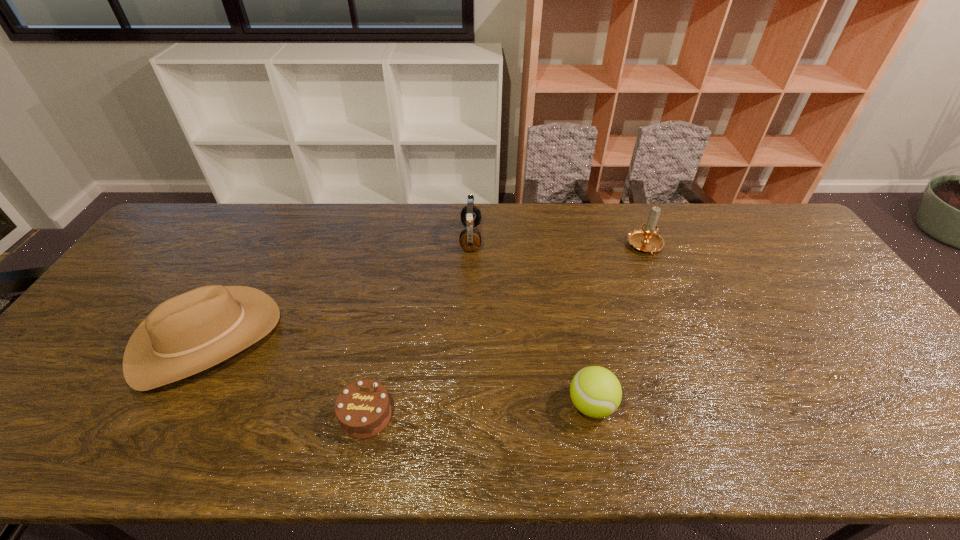
Where is `free space located on the right of the second object from right to left`? The width and height of the screenshot is (960, 540). free space located on the right of the second object from right to left is located at coordinates tap(663, 405).

Where is `vacant space located 0.120m on the back of the chocolate cake`? The width and height of the screenshot is (960, 540). vacant space located 0.120m on the back of the chocolate cake is located at coordinates (379, 352).

You are a GUI agent. You are given a task and a screenshot of the screen. Output one action in this format:
    pyautogui.click(x=<x>, y=<y>)
    Task: Click on the candle present at the far edge
    Image resolution: width=960 pixels, height=540 pixels.
    Given the screenshot: What is the action you would take?
    pyautogui.click(x=646, y=239)

Find the location of a particular element. headset that is at the far edge is located at coordinates (470, 239).

Locate an element on the screen. The image size is (960, 540). tennis ball at the near edge is located at coordinates (595, 391).

The width and height of the screenshot is (960, 540). Find the location of `chocolate cake that is at the near edge`. chocolate cake that is at the near edge is located at coordinates (363, 410).

This screenshot has height=540, width=960. Identify the location of object that is positioned at the left edge. (191, 332).

Identify the location of free space at the far edge of the desktop. (336, 233).

Locate an element on the screen. This screenshot has height=540, width=960. free space at the near edge is located at coordinates pos(776,460).

Locate an element on the screen. vacant space at the right edge of the desktop is located at coordinates (854, 345).